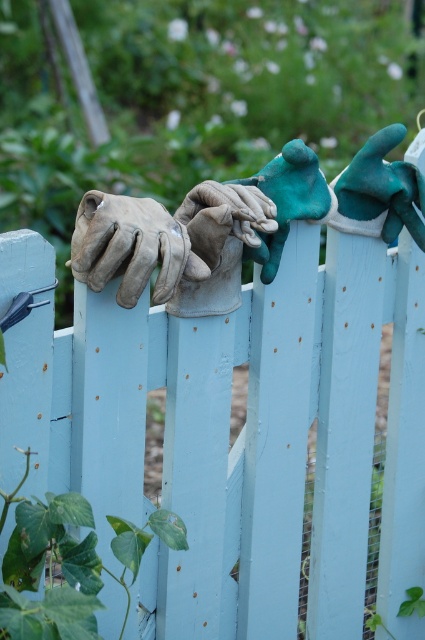
Question: Among these objects, which one is farthest from the camera?

Choices:
 (A) green matte glove at center
 (B) green fabric glove at upper right

Answer: (B)

Question: Does leather gloves at left appear over green matte glove at center?

Choices:
 (A) yes
 (B) no

Answer: (B)

Question: Is leather gloves at left positioned in front of green fabric glove at upper right?

Choices:
 (A) yes
 (B) no

Answer: (A)

Question: Is leather gloves at left to the right of green matte glove at center from the viewer's perspective?

Choices:
 (A) no
 (B) yes

Answer: (A)

Question: Which point is closer to the camera?

Choices:
 (A) (309, 163)
 (B) (99, 243)
 (C) (419, 172)

Answer: (B)

Question: Among these points, which one is nearest to the camera?

Choices:
 (A) (101, 227)
 (B) (328, 202)
 (C) (362, 186)

Answer: (A)